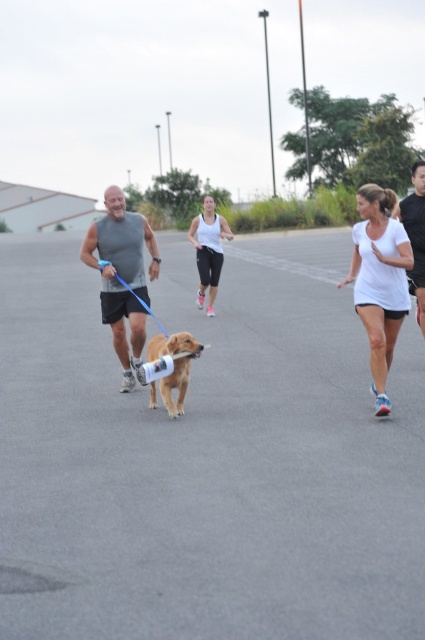
Is point (127, 310) positioned before point (212, 248)?

Yes, point (127, 310) is in front of point (212, 248).

Based on the photo, which is more to the left, matte gray tank top at center or white matte tank top at center?

From the viewer's perspective, matte gray tank top at center appears more on the left side.

What do you see at coordinates (122, 276) in the screenshot?
I see `matte gray tank top at center` at bounding box center [122, 276].

Locate an element on the screen. The width and height of the screenshot is (425, 640). matte gray tank top at center is located at coordinates (122, 276).

Can you confirm if white matte shirt at center is thinner than white matte tank top at center?

Yes.

Is point (387, 362) positioned before point (206, 230)?

Yes, it is.

Locate an element on the screen. This screenshot has width=425, height=640. white matte shirt at center is located at coordinates (379, 280).

Is point (204, 285) less distant than point (418, 244)?

No, (204, 285) is further to viewer.

Which is behind, point (217, 230) or point (416, 186)?

The point (217, 230) is more distant.

Who is more forward, (218, 228) or (414, 172)?

Positioned in front is point (414, 172).

Where is `white matte tank top at center`? white matte tank top at center is located at coordinates (209, 250).